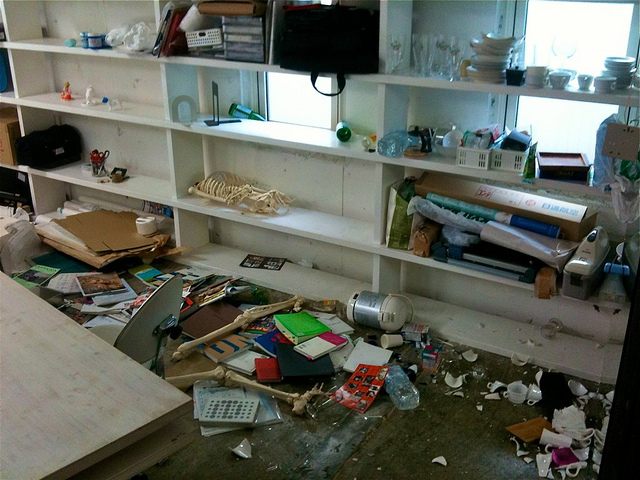
The height and width of the screenshot is (480, 640). What are the coordinates of `books on floor` in the screenshot? It's located at (90, 278), (105, 282), (108, 307), (134, 283), (156, 278), (198, 284), (35, 267).